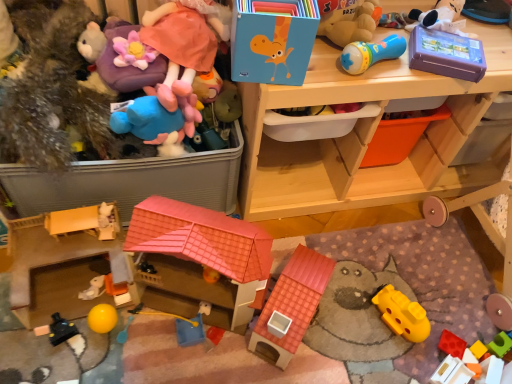
Where is `vacant area that is in front of blue plastic toy at center, the 7th toy viewed from the right`? vacant area that is in front of blue plastic toy at center, the 7th toy viewed from the right is located at coordinates (179, 367).